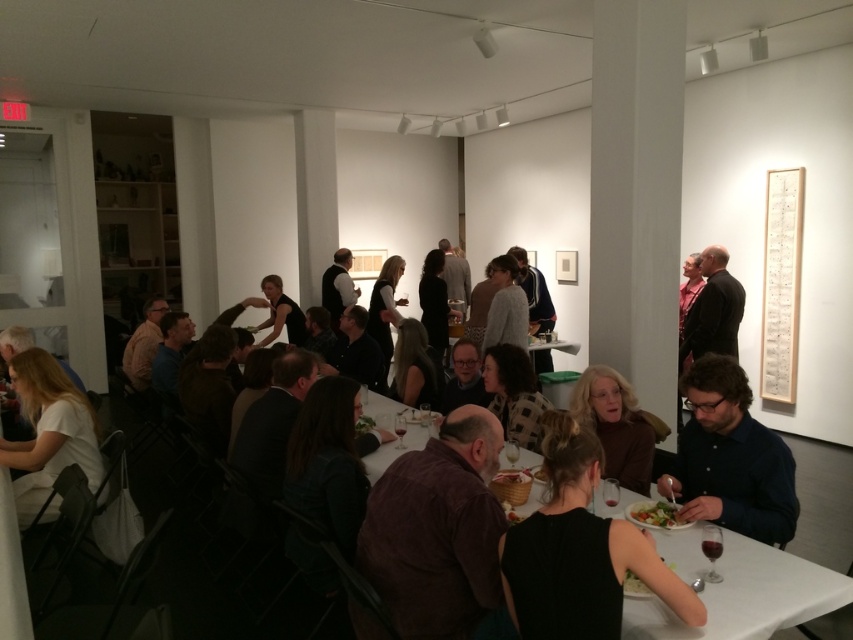
Question: Does white glossy table at center have a larger size compared to matte brown sweater at center?

Choices:
 (A) yes
 (B) no

Answer: (B)

Question: Which point appears farthest from the camera in this image?

Choices:
 (A) (292, 320)
 (B) (601, 627)
 (C) (697, 492)
 (D) (488, 534)

Answer: (A)

Question: Which object appears farthest from the camera in this image?

Choices:
 (A) matte brown sweater at center
 (B) black fabric dress at lower center
 (C) dark blue shirt at lower right

Answer: (A)

Question: Is white matte shirt at lower left smaller than black matte shirt at center?

Choices:
 (A) yes
 (B) no

Answer: (A)

Question: Can you confirm if dark brown suit at center is wider than black matte shirt at center?

Choices:
 (A) no
 (B) yes

Answer: (A)

Question: Among these points, which one is nearest to the camera?

Choices:
 (A) (287, 308)
 (B) (720, 301)
 (C) (619, 625)
 (D) (477, 547)

Answer: (C)